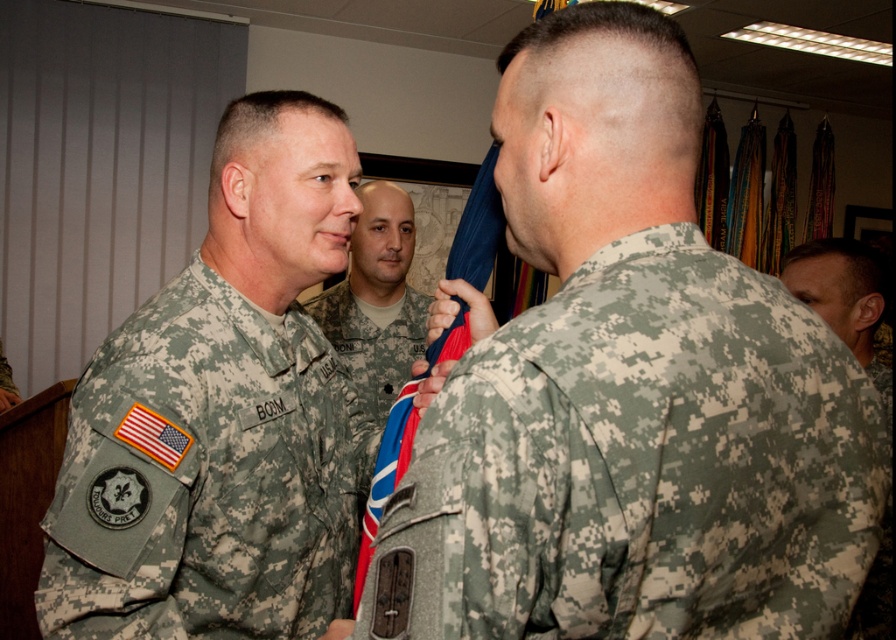
Does point (597, 596) come behind point (332, 604)?

No, (597, 596) is closer to viewer.

Locate an element on the screen. This screenshot has width=896, height=640. digital camouflage uniform at back is located at coordinates (627, 392).

Does camouflage fabric uniform at left have a larger size compared to camouflage uniform at right?

Yes, camouflage fabric uniform at left is bigger than camouflage uniform at right.

What do you see at coordinates (204, 476) in the screenshot?
I see `camouflage fabric uniform at left` at bounding box center [204, 476].

Find the location of a particular element. camouflage fabric uniform at left is located at coordinates (204, 476).

Locate an element on the screen. The width and height of the screenshot is (896, 640). digital camouflage uniform at back is located at coordinates (627, 392).

Is digital camouflage uniform at back taller than camouflage uniform at right?

Yes, digital camouflage uniform at back is taller than camouflage uniform at right.

This screenshot has height=640, width=896. Describe the element at coordinates (627, 392) in the screenshot. I see `digital camouflage uniform at back` at that location.

The width and height of the screenshot is (896, 640). Find the location of `digital camouflage uniform at back`. digital camouflage uniform at back is located at coordinates (627, 392).